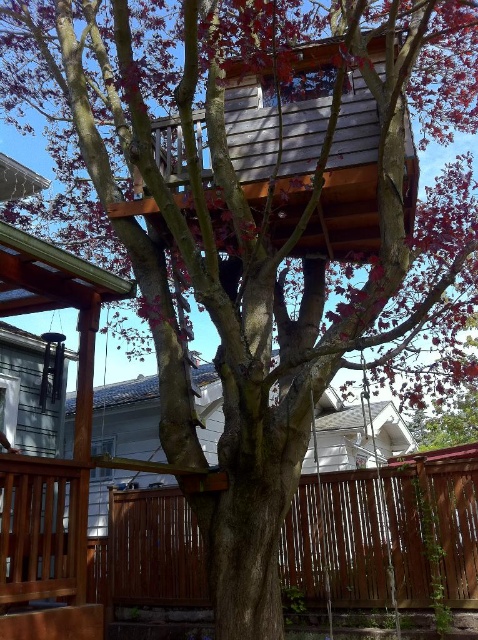
Does brown wooden porch at lower left have a greater width compared to wooden swing at lower right?

Yes.

How distant is brown wooden porch at lower left from wooden swing at lower right?

brown wooden porch at lower left is 16.48 inches from wooden swing at lower right.

Is point (380, 486) farther from camera compared to point (392, 604)?

Yes, point (380, 486) is behind point (392, 604).

Locate an element on the screen. The width and height of the screenshot is (478, 640). brown wooden porch at lower left is located at coordinates (386, 536).